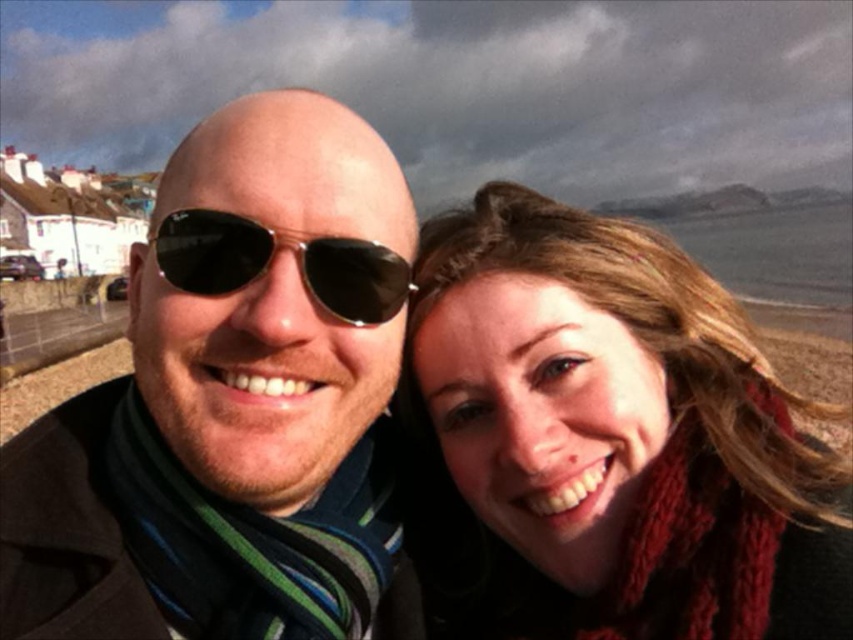
Is point (212, 316) more distant than point (314, 236)?

No.

Does matte black sunglasses at center have a greater width compared to black reflective sunglasses at center?

Yes, matte black sunglasses at center is wider than black reflective sunglasses at center.

What are the coordinates of `matte black sunglasses at center` in the screenshot? It's located at (234, 404).

Between matte black sunglasses at center and knitted red scarf at right, which one appears on the right side from the viewer's perspective?

Positioned to the right is knitted red scarf at right.

Measure the distance between point (328, 506) and camera.

Point (328, 506) is 24.12 meters from camera.

Where is `matte black sunglasses at center`? matte black sunglasses at center is located at coordinates (234, 404).

I want to click on knitted red scarf at right, so click(610, 440).

Does knitted red scarf at right have a lesser height compared to black reflective sunglasses at center?

In fact, knitted red scarf at right may be taller than black reflective sunglasses at center.

Who is more forward, (671, 406) or (321, 253)?

Positioned in front is point (321, 253).

Where is `knitted red scarf at right`? This screenshot has width=853, height=640. knitted red scarf at right is located at coordinates (610, 440).